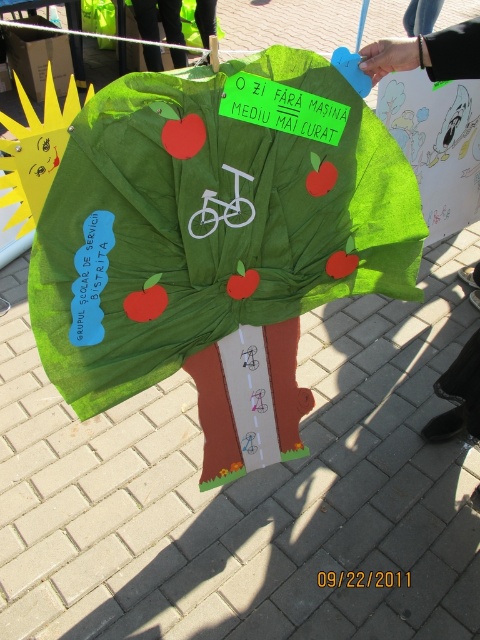
You are trying to decide whether to place a small potted plant between the green fabric umbrella at center and the green fabric at center. Based on their sizes, which object should the plant be closer to?

The green fabric umbrella at center might be wider than green fabric at center, so the plant should be placed closer to the green fabric at center to avoid being overshadowed by the larger umbrella.

You are standing in front of the tree poster and need to place a sticker exactly at point (216, 234). According to the scene description, where should you place the sticker?

You should place the sticker on the green fabric umbrella at center because the point (216, 234) is located there.